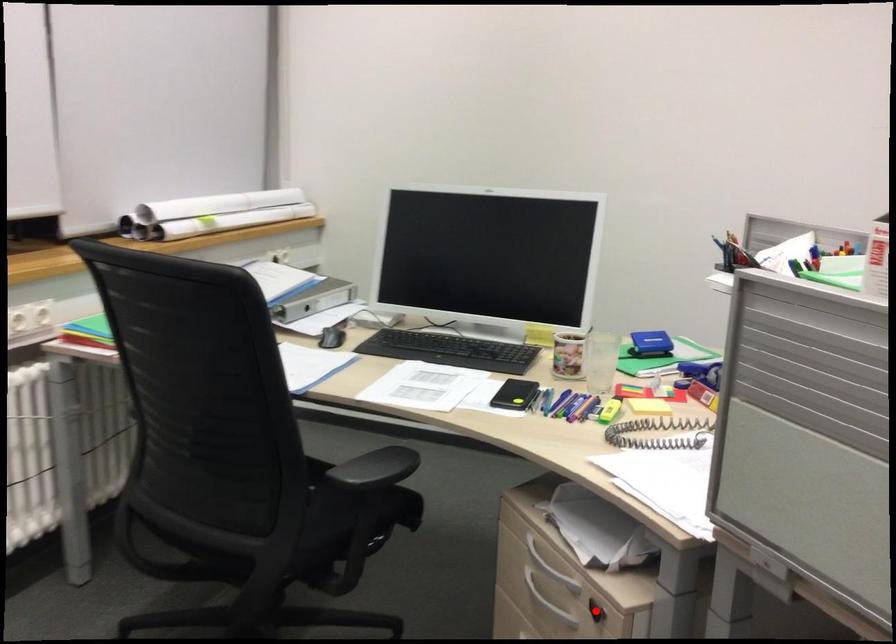
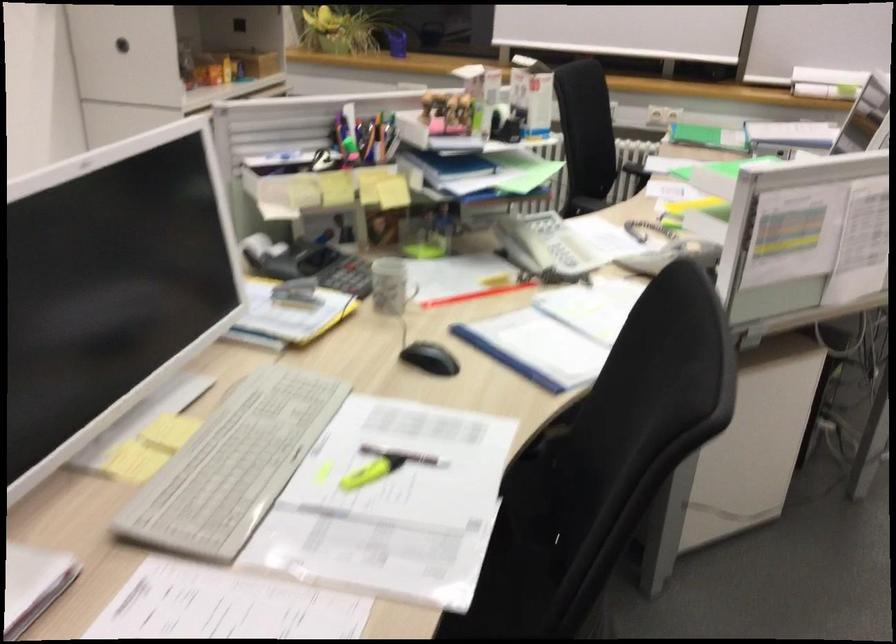
Question: I am providing you with two images of the same scene from different viewpoints. A red point is marked on the first image. At the location where the point appears in image 1, is it still visible in image 2?

Choices:
 (A) Yes
 (B) No

Answer: (B)